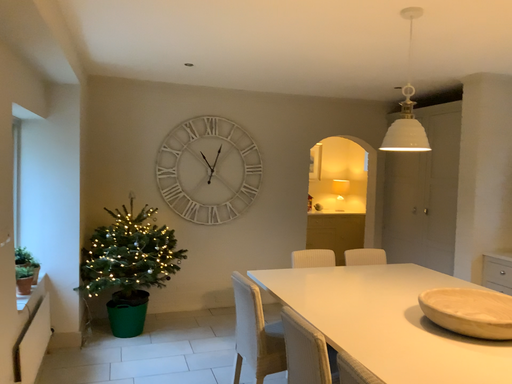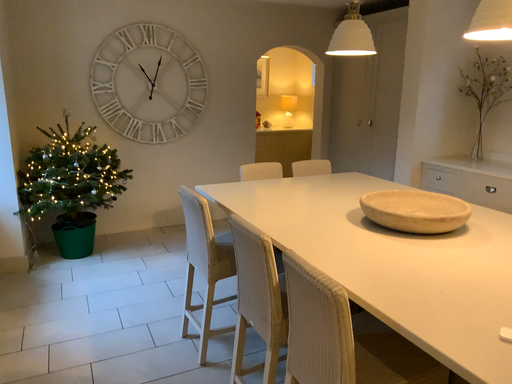
Question: How did the camera likely rotate when shooting the video?

Choices:
 (A) rotated left
 (B) rotated right

Answer: (B)